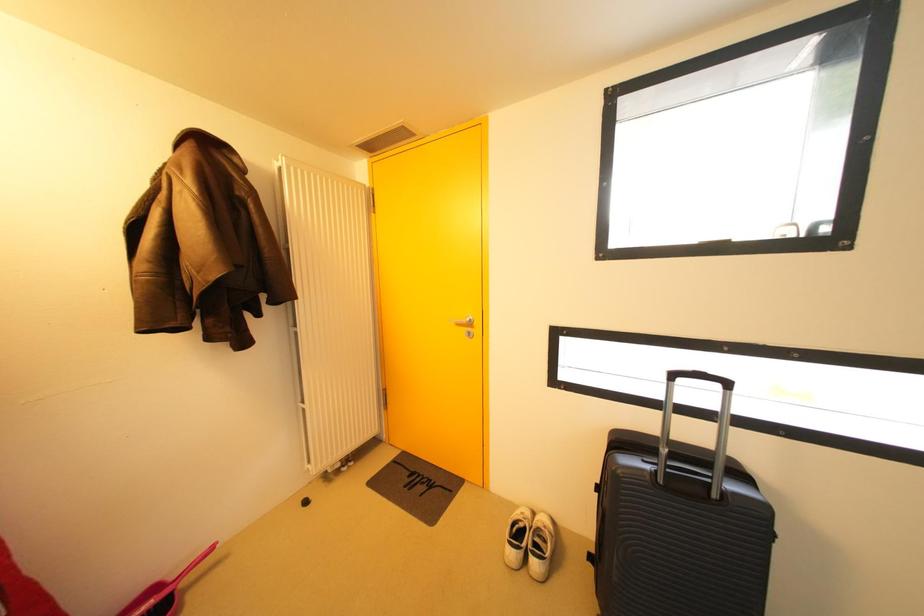
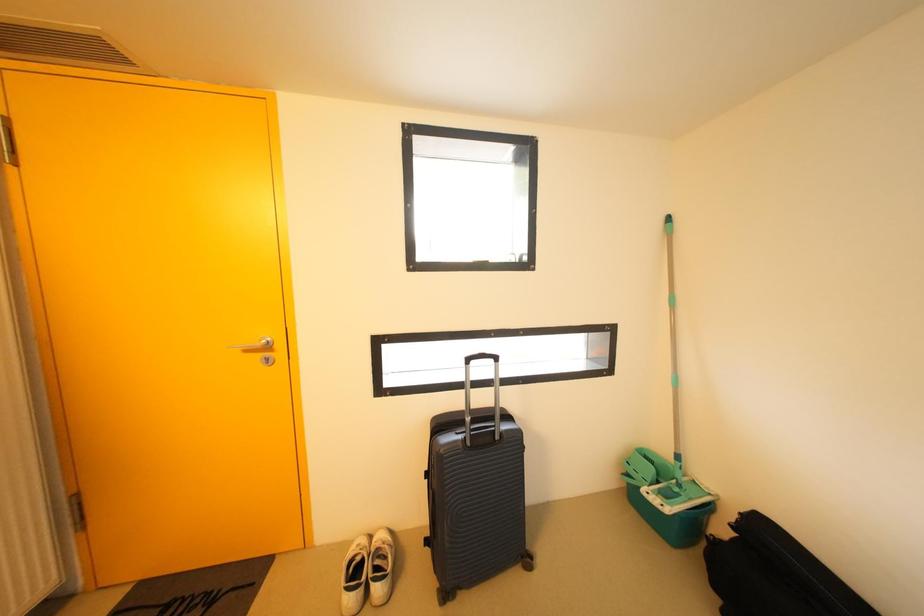
Question: The camera is either moving clockwise (left) or counter-clockwise (right) around the object. The first image is from the beginning of the video and the second image is from the end. Is the camera moving left or right when shooting the video?

Choices:
 (A) Left
 (B) Right

Answer: (A)